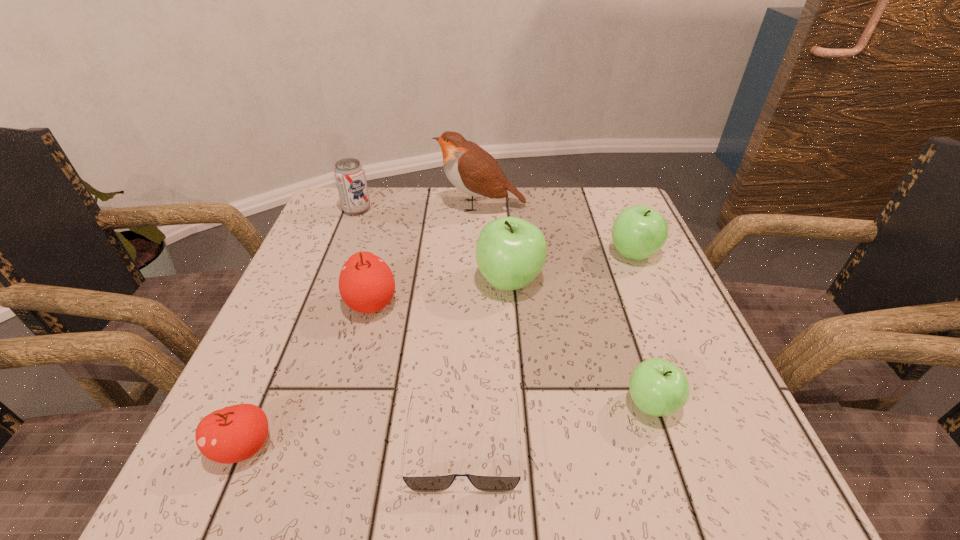
Find the location of a particular element. the tallest object is located at coordinates (471, 169).

Locate an element on the screen. bird is located at coordinates (471, 169).

Where is `the third apple from right to left`? The image size is (960, 540). the third apple from right to left is located at coordinates (510, 252).

Where is `the tallest apple`? The width and height of the screenshot is (960, 540). the tallest apple is located at coordinates (510, 252).

Locate an element on the screen. beer can is located at coordinates (349, 174).

Locate an element on the screen. the second smallest green apple is located at coordinates (638, 232).

Locate an element on the screen. the right red apple is located at coordinates (x=366, y=283).

Find the location of a particular element. The image size is (960, 540). the second apple from left to right is located at coordinates (366, 283).

The width and height of the screenshot is (960, 540). Identify the location of the smallest green apple. (657, 387).

Locate an element on the screen. the smaller red apple is located at coordinates (235, 433).